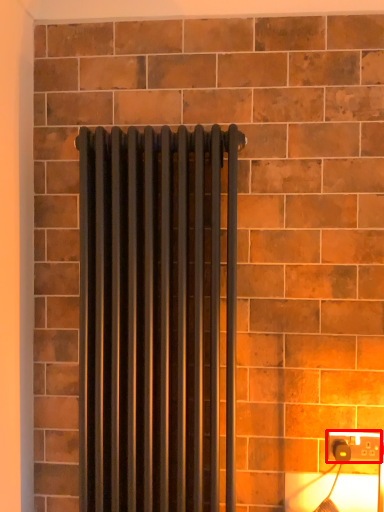
Question: From the image's perspective, what is the correct spatial positioning of power plugs and sockets (annotated by the red box) in reference to radiator?

Choices:
 (A) above
 (B) below

Answer: (B)